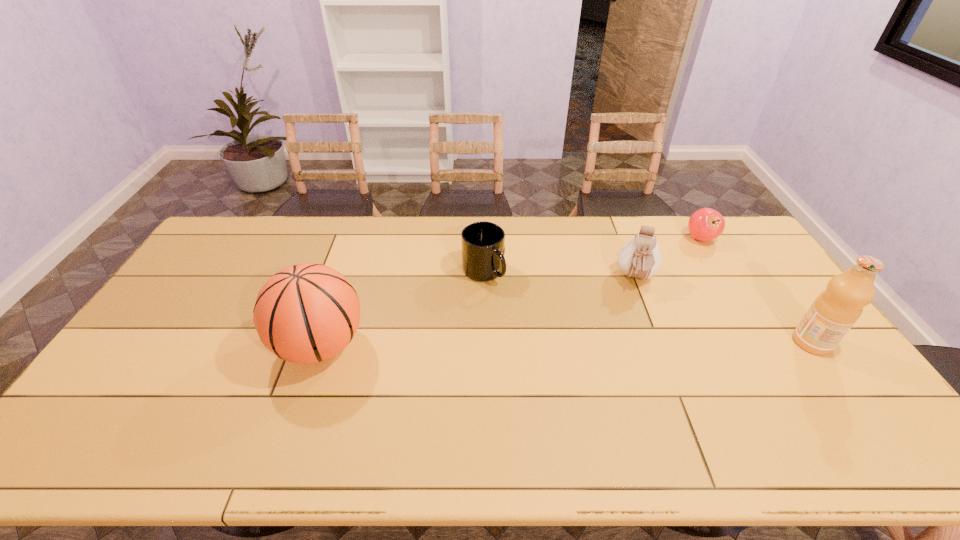
At what (x,y) coordinates should I click in order to perform the action: click on vacant area situated on the front-facing side of the third object from right to left. Please return your answer as a coordinate pair (x, y). Looking at the image, I should click on click(x=638, y=341).

This screenshot has height=540, width=960. I want to click on vacant space located 0.220m on the front-facing side of the third object from right to left, so (x=638, y=346).

The image size is (960, 540). Identify the location of vacant space located with the handle on the side of the fourth tallest object. (513, 321).

Identify the location of vacant region located with the handle on the side of the fourth tallest object. The width and height of the screenshot is (960, 540). [x=537, y=358].

Where is `vacant space situated 0.180m with the handle on the side of the fourth tallest object`? vacant space situated 0.180m with the handle on the side of the fourth tallest object is located at coordinates (516, 326).

The height and width of the screenshot is (540, 960). Find the location of `vacant space located on the stem of the shortest object`. vacant space located on the stem of the shortest object is located at coordinates (684, 265).

You are a GUI agent. You are given a task and a screenshot of the screen. Output one action in this format:
    pyautogui.click(x=<x>, y=<y>)
    Task: Click on the blank space located 0.070m on the stem of the shortest object
    Image resolution: width=960 pixels, height=540 pixels.
    Given the screenshot: What is the action you would take?
    pyautogui.click(x=689, y=256)

The height and width of the screenshot is (540, 960). Identify the location of free space located 0.080m on the stem of the shortest object. (689, 258).

At what (x,y) coordinates should I click in order to perform the action: click on object present at the far edge. Please return your answer as a coordinate pair (x, y). Looking at the image, I should click on (706, 224).

At what (x,y) coordinates should I click in order to perform the action: click on fruit juice located at the right edge. Please return your answer as a coordinate pair (x, y). Looking at the image, I should click on (835, 310).